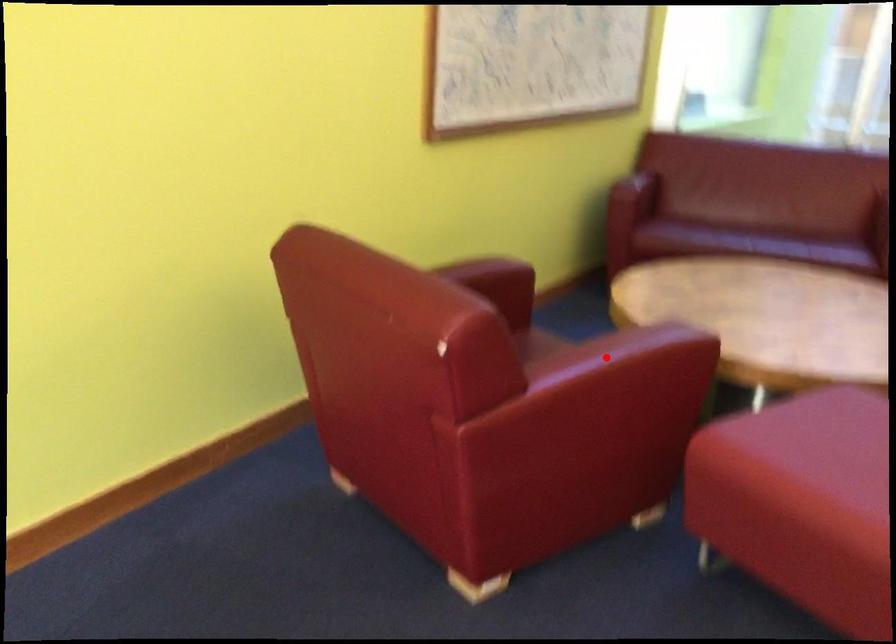
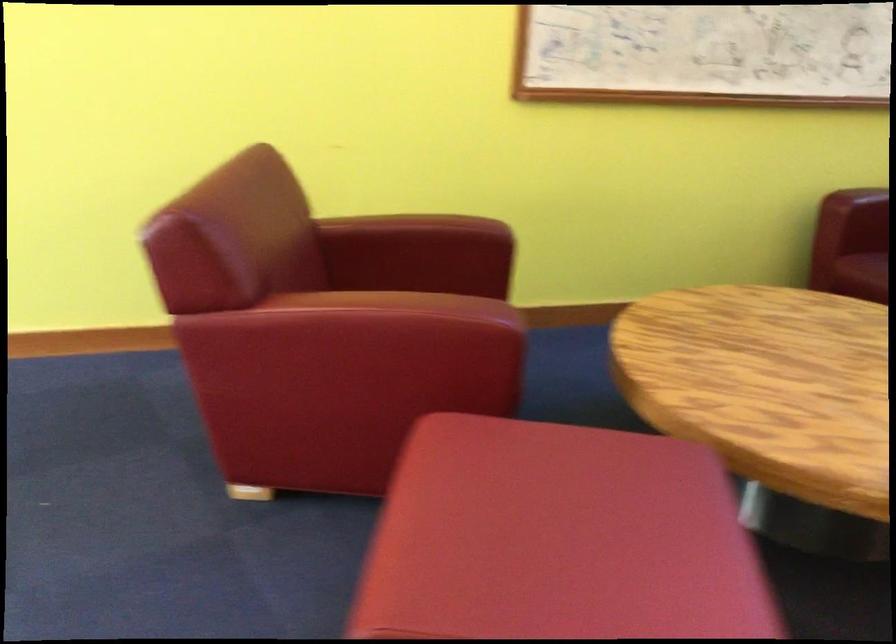
Where in the second image is the point corresponding to the highlighted location from the first image?

(356, 301)